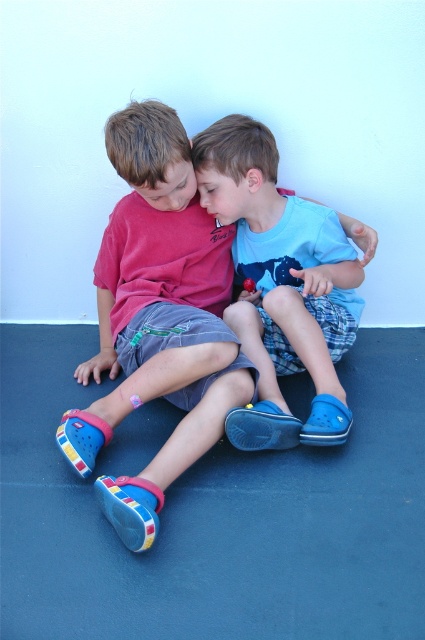
Based on the scene description, where is the matte pink shorts at center located in terms of coordinates?

The matte pink shorts at center is located at coordinates point (158, 317).

You are a photographer trying to capture a closeup shot of the two boys. You need to position your camera so that it can focus on both the matte pink shorts at center and the blue rubber shoes at center. Based on their positions, which object should you place on the left side of your camera frame?

The matte pink shorts at center should be placed on the left side of the camera frame because it is to the left of the blue rubber shoes at center.